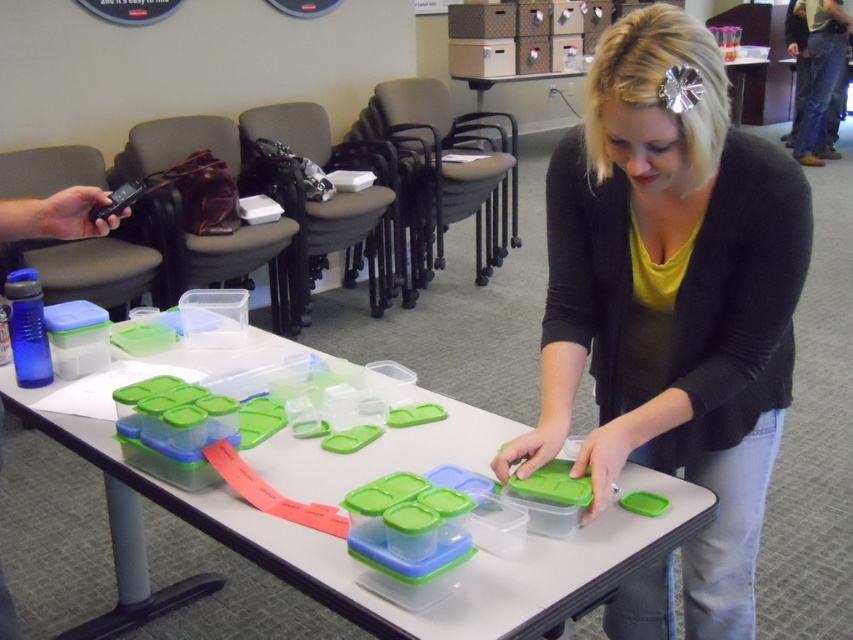
Where are the clear plastic containers at center located in the image?

The clear plastic containers at center are located at point (347, 557) in the image.